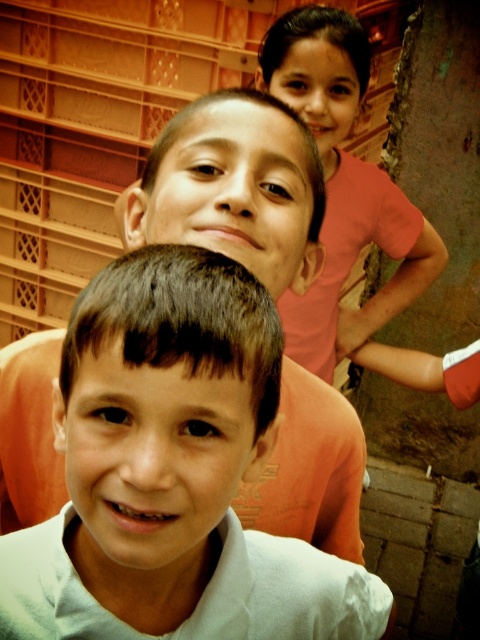
You are a photographer trying to capture a clear shot of both the light gray cotton shirt at center and the pink cotton shirt at upper right. Which shirt should you focus on first to ensure it appears sharp in the photo?

You should focus on the light gray cotton shirt at center first because it is smaller and closer to the camera than the pink cotton shirt at upper right, ensuring it remains sharp in the photo.

You are a photographer trying to capture a photo of the light gray cotton shirt at center and the pink cotton shirt at upper right. From the photographer perspective, which shirt is positioned to the right side of the other?

The light gray cotton shirt at center is to the left of the pink cotton shirt at upper right, so the pink cotton shirt at upper right is positioned to the right side of the light gray cotton shirt at center.

You are a photographer trying to adjust the lighting for a group photo. You notice the light gray cotton shirt at center and the pink cotton shirt at upper right. Which of these two shirts is shorter in height?

The light gray cotton shirt at center is shorter in height compared to the pink cotton shirt at upper right.